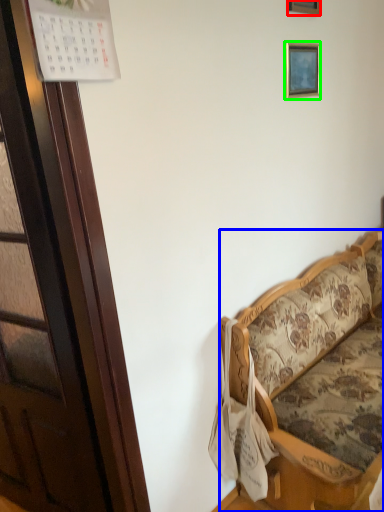
Question: Which object is the farthest from picture frame (highlighted by a red box)? Choose among these: studio couch (highlighted by a blue box) or picture frame (highlighted by a green box).

Choices:
 (A) studio couch
 (B) picture frame

Answer: (A)